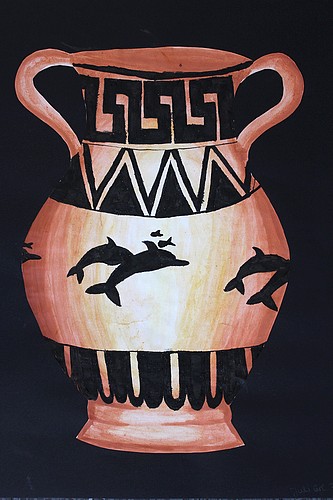
This screenshot has width=333, height=500. I want to click on handle, so [290, 91], [25, 91].